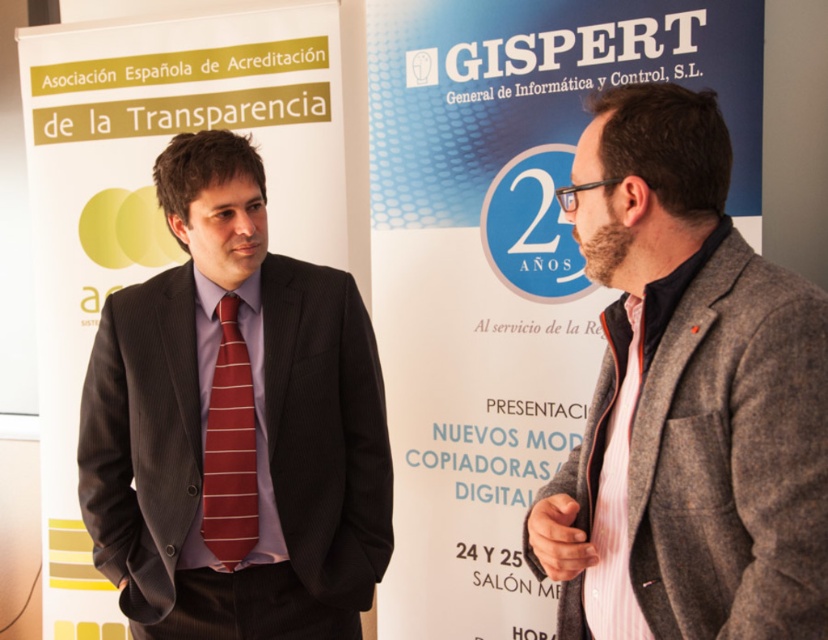
Question: Can you confirm if gray woolen blazer at right is positioned below red striped tie at center?

Choices:
 (A) no
 (B) yes

Answer: (A)

Question: Which of the following is the farthest from the observer?

Choices:
 (A) gray woolen blazer at right
 (B) red striped tie at center
 (C) pink striped tie at right
 (D) matte black suit at left

Answer: (B)

Question: Can you confirm if gray woolen blazer at right is positioned below pink striped tie at right?

Choices:
 (A) no
 (B) yes

Answer: (A)

Question: Does gray woolen blazer at right appear over pink striped tie at right?

Choices:
 (A) no
 (B) yes

Answer: (B)

Question: Which of the following is the farthest from the observer?

Choices:
 (A) (210, 525)
 (B) (677, 195)
 (C) (605, 579)
 (D) (244, 442)

Answer: (D)

Question: Estimate the real-world distances between objects in this image. Which object is closer to the red striped tie at center?

Choices:
 (A) pink striped tie at right
 (B) matte black suit at left

Answer: (B)